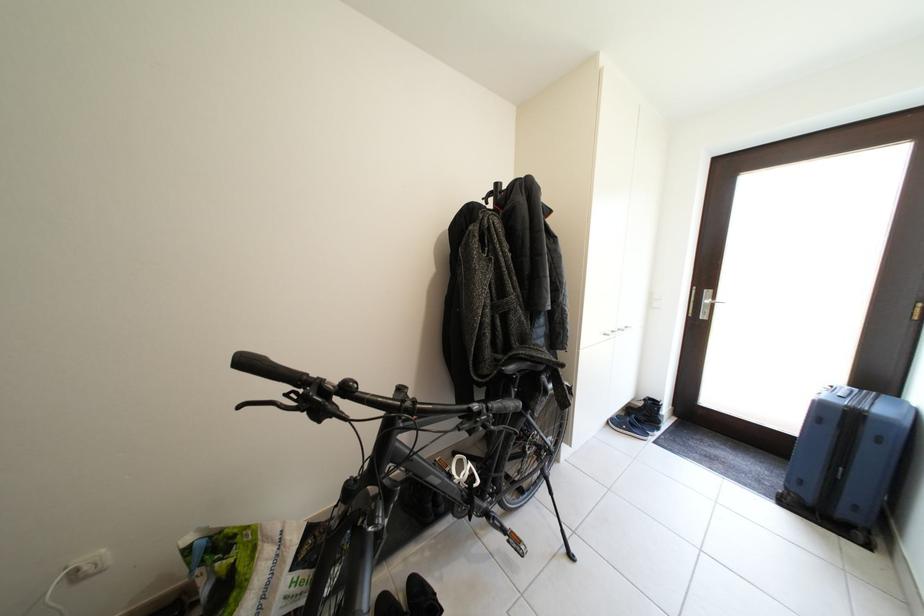
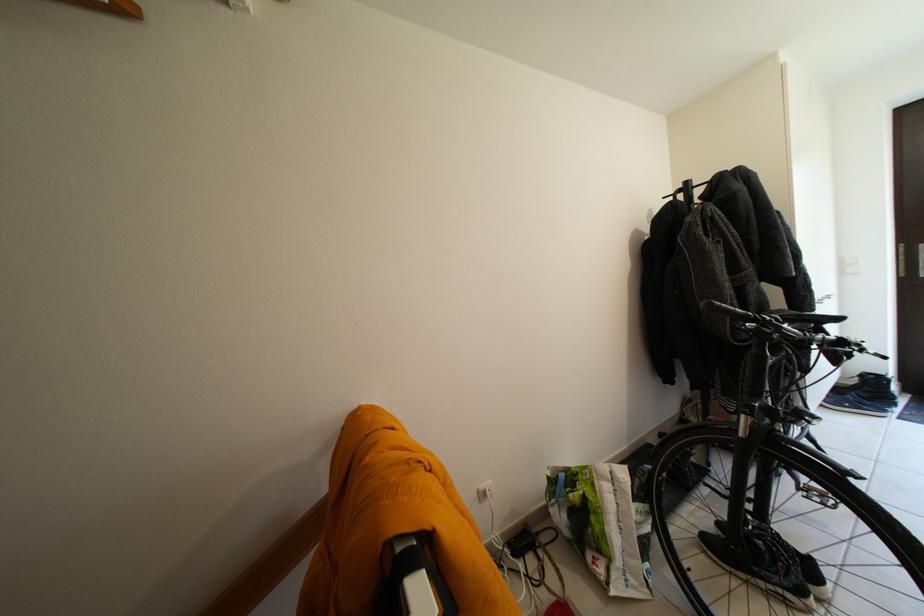
The point at (x=638, y=415) is marked in the first image. Where is the corresponding point in the second image?

(845, 395)